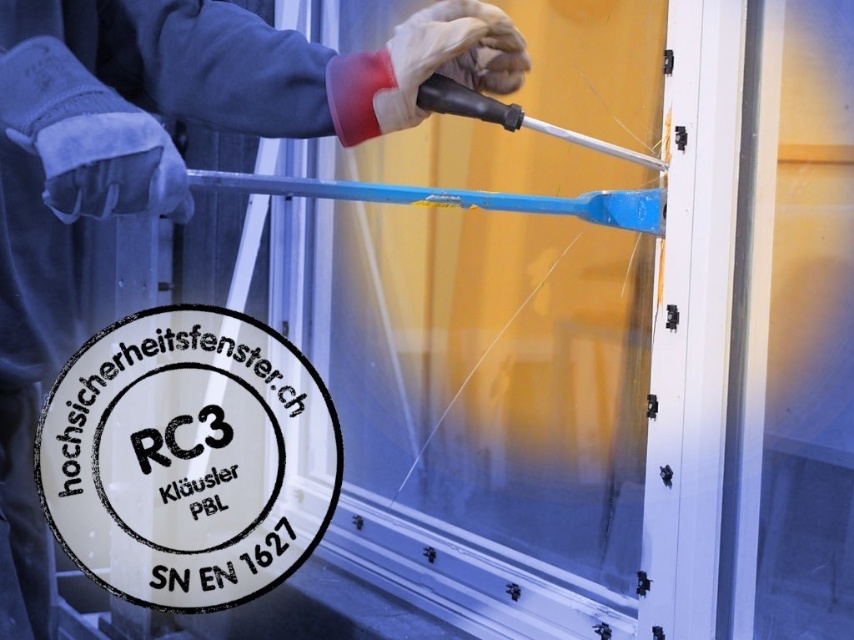
Is blue plastic tool at upper center wider than white leather glove at upper center?

Correct, the width of blue plastic tool at upper center exceeds that of white leather glove at upper center.

The height and width of the screenshot is (640, 854). I want to click on blue plastic tool at upper center, so click(x=161, y=164).

Does point (44, 193) come in front of point (453, 22)?

That is True.

You are a GUI agent. You are given a task and a screenshot of the screen. Output one action in this format:
    pyautogui.click(x=<x>, y=<y>)
    Task: Click on the blue plastic tool at upper center
    The width and height of the screenshot is (854, 640).
    Given the screenshot: What is the action you would take?
    pyautogui.click(x=161, y=164)